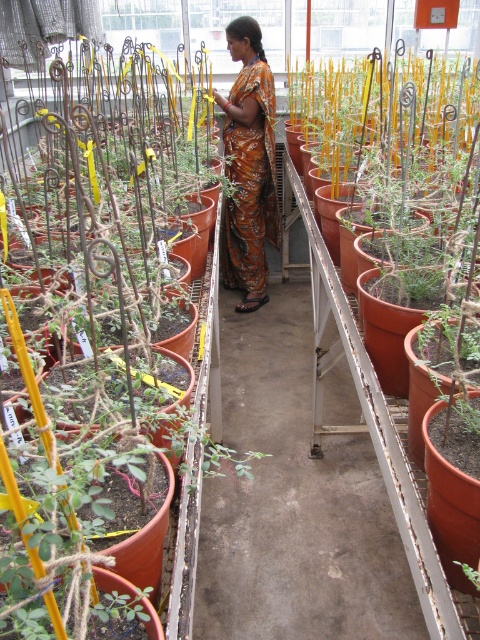
Question: Is matte brown pot at center bigger than matte orange pot at center-right?

Choices:
 (A) yes
 (B) no

Answer: (B)

Question: Which of these objects is positioned closest to the matte orange pot at center-right?

Choices:
 (A) orange printed sari at center
 (B) matte brown pot at center

Answer: (B)

Question: Which of the following is the closest to the observer?

Choices:
 (A) matte orange pot at center-right
 (B) matte brown pot at center

Answer: (B)

Question: Does matte brown pot at center have a greater width compared to orange printed sari at center?

Choices:
 (A) no
 (B) yes

Answer: (B)

Question: Is matte orange pot at center-right below orange printed sari at center?

Choices:
 (A) yes
 (B) no

Answer: (A)

Question: Which of the following is the closest to the observer?

Choices:
 (A) (157, 369)
 (B) (363, 166)
 (C) (237, 308)

Answer: (A)